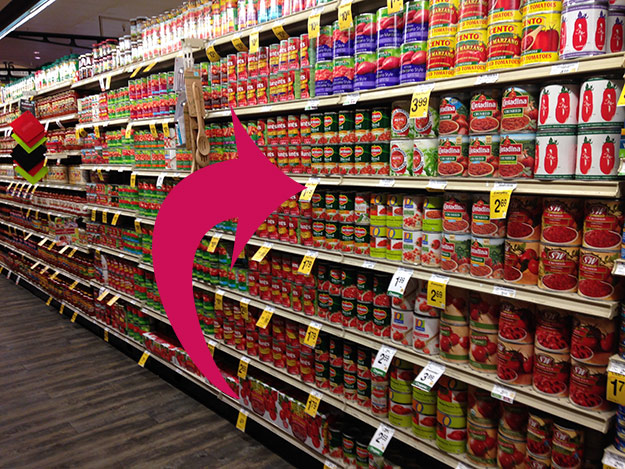
You are a GUI agent. You are given a task and a screenshot of the screen. Output one action in this format:
    pyautogui.click(x=<x>, y=<y>)
    Task: Click on the lights in ceiling
    Image resolution: width=625 pixels, height=469 pixels.
    Given the screenshot: What is the action you would take?
    pyautogui.click(x=35, y=51), pyautogui.click(x=38, y=57)